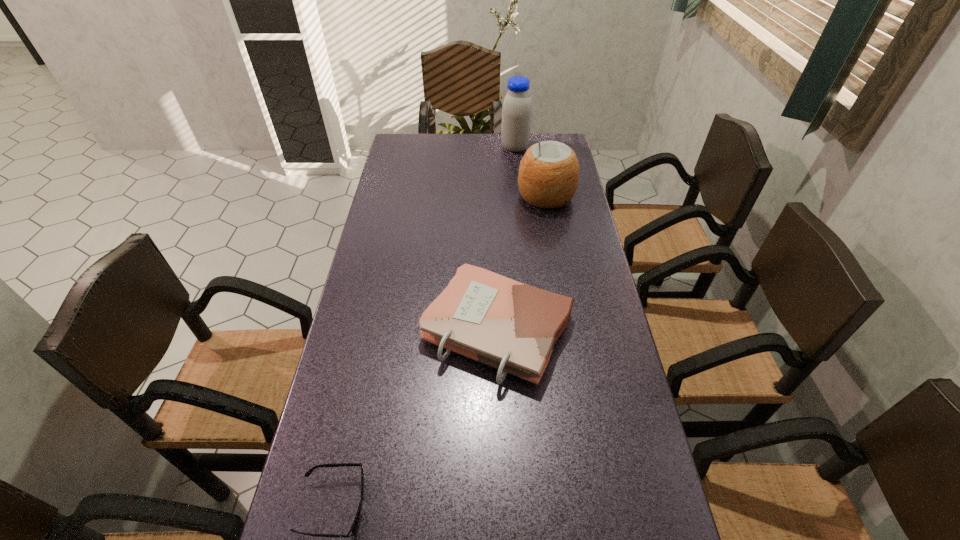
The width and height of the screenshot is (960, 540). In order to click on the second closest object relative to the sunglasses in this screenshot , I will do `click(548, 176)`.

Select which object is the closest to the second nearest object. Please provide its 2D coordinates. Your answer should be formatted as a tuple, i.e. [(x, y)], where the tuple contains the x and y coordinates of a point satisfying the conditions above.

[(352, 529)]